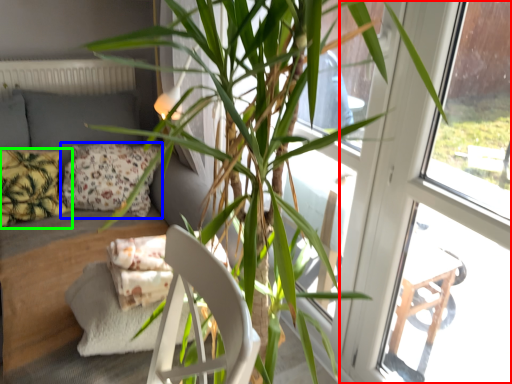
Question: Which object is positioned closest to screen door (highlighted by a red box)? Select from pillow (highlighted by a blue box) and pillow (highlighted by a green box).

Choices:
 (A) pillow
 (B) pillow

Answer: (A)